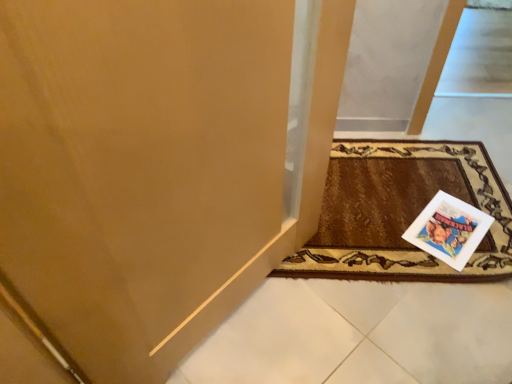
Question: Considering the relative sizes of brown woven mat at lower right and white paper postcard at lower right in the image provided, is brown woven mat at lower right thinner than white paper postcard at lower right?

Choices:
 (A) no
 (B) yes

Answer: (A)

Question: Are brown woven mat at lower right and white paper postcard at lower right beside each other?

Choices:
 (A) no
 (B) yes

Answer: (A)

Question: Is brown woven mat at lower right oriented towards white paper postcard at lower right?

Choices:
 (A) yes
 (B) no

Answer: (A)

Question: Is brown woven mat at lower right oriented away from white paper postcard at lower right?

Choices:
 (A) no
 (B) yes

Answer: (A)

Question: Is brown woven mat at lower right behind white paper postcard at lower right?

Choices:
 (A) yes
 (B) no

Answer: (B)

Question: Is brown woven mat at lower right not within white paper postcard at lower right?

Choices:
 (A) yes
 (B) no

Answer: (A)

Question: Is white paper postcard at lower right bigger than brown woven mat at lower right?

Choices:
 (A) no
 (B) yes

Answer: (A)

Question: Does white paper postcard at lower right turn towards brown woven mat at lower right?

Choices:
 (A) yes
 (B) no

Answer: (A)

Question: Does white paper postcard at lower right have a lesser height compared to brown woven mat at lower right?

Choices:
 (A) yes
 (B) no

Answer: (A)

Question: Is the position of white paper postcard at lower right more distant than that of brown woven mat at lower right?

Choices:
 (A) yes
 (B) no

Answer: (A)

Question: Considering the relative sizes of white paper postcard at lower right and brown woven mat at lower right in the image provided, is white paper postcard at lower right wider than brown woven mat at lower right?

Choices:
 (A) no
 (B) yes

Answer: (A)

Question: Is white paper postcard at lower right next to brown woven mat at lower right?

Choices:
 (A) yes
 (B) no

Answer: (B)

Question: From a real-world perspective, is white paper postcard at lower right physically located above or below brown woven mat at lower right?

Choices:
 (A) above
 (B) below

Answer: (B)